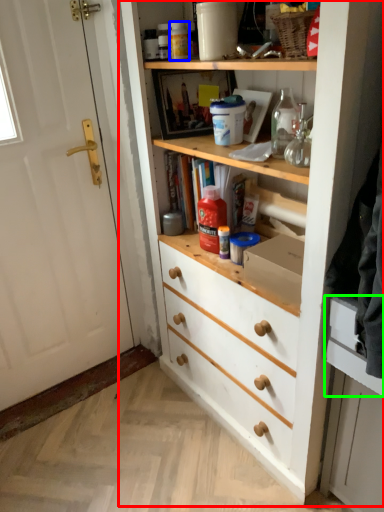
Question: Which object is positioned farthest from cupboard (highlighted by a red box)? Select from bottle (highlighted by a blue box) and drawer (highlighted by a green box).

Choices:
 (A) bottle
 (B) drawer

Answer: (A)